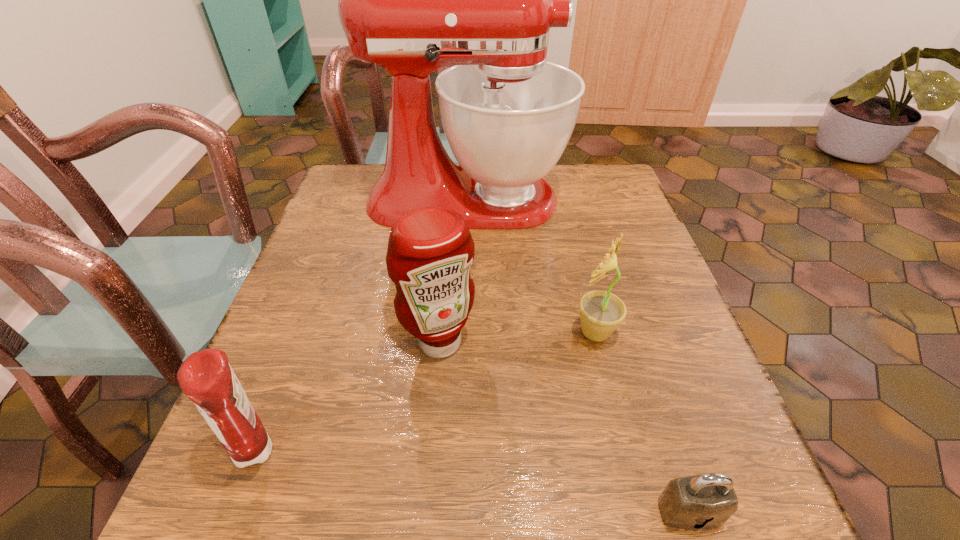
What are the coordinates of `free space between the nearest object and the leftmost object` in the screenshot? It's located at (473, 481).

Locate an element on the screen. This screenshot has width=960, height=540. free space between the right condiment and the shortest object is located at coordinates (564, 427).

Find the location of `empty location between the shorter condiment and the taller condiment`. empty location between the shorter condiment and the taller condiment is located at coordinates (348, 396).

I want to click on object that can be found as the fourth closest to the sunflower, so click(x=206, y=378).

The height and width of the screenshot is (540, 960). Identify the location of object that is the closest to the shortest object. (601, 312).

Where is `vacant region that satisfies the following two spatial constraints: 1. on the face of the sunflower; 2. on the front side of the left condiment`? The width and height of the screenshot is (960, 540). vacant region that satisfies the following two spatial constraints: 1. on the face of the sunflower; 2. on the front side of the left condiment is located at coordinates (624, 450).